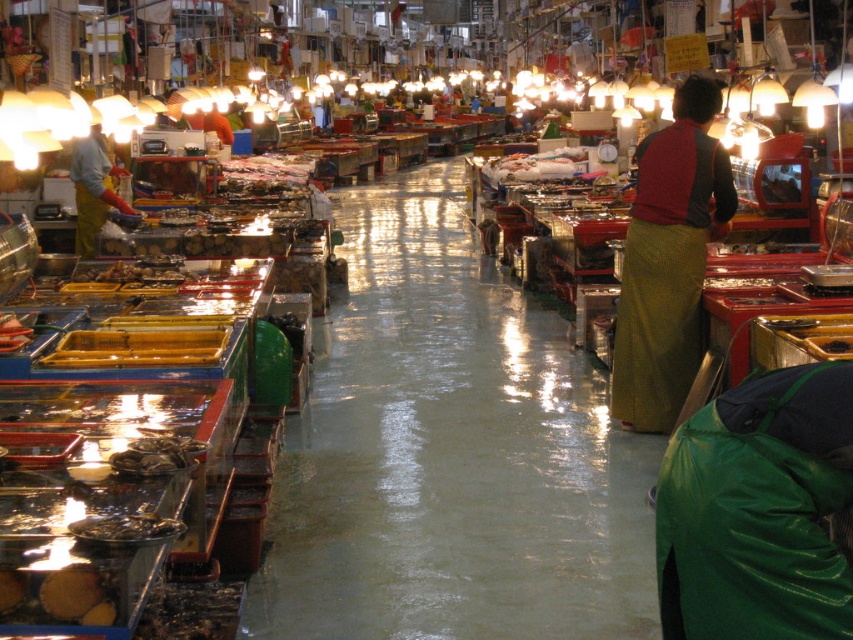
Between green woven skirt at right and shiny metallic fish at center, which one is positioned higher?

green woven skirt at right is above.

Does green woven skirt at right lie in front of shiny metallic fish at center?

No.

This screenshot has width=853, height=640. I want to click on green woven skirt at right, so click(x=668, y=259).

You are a GUI agent. You are given a task and a screenshot of the screen. Output one action in this format:
    pyautogui.click(x=<x>, y=<y>)
    Task: Click on the green woven skirt at right
    The image size is (853, 640).
    Given the screenshot: What is the action you would take?
    pyautogui.click(x=668, y=259)

Is yellow rubber gloves at left above shiny metallic fish at center?

Indeed, yellow rubber gloves at left is positioned over shiny metallic fish at center.

Does yellow rubber gloves at left have a lesser width compared to shiny metallic fish at center?

Incorrect, yellow rubber gloves at left's width is not less than shiny metallic fish at center's.

The image size is (853, 640). What are the coordinates of `yellow rubber gloves at left` in the screenshot? It's located at (93, 189).

Is point (86, 598) positioned behind point (152, 464)?

No, it is in front of (152, 464).

Describe the element at coordinates (76, 595) in the screenshot. I see `smooth brown bread at lower left` at that location.

Find the location of `smooth brown bread at lower left`. smooth brown bread at lower left is located at coordinates pyautogui.click(x=76, y=595).